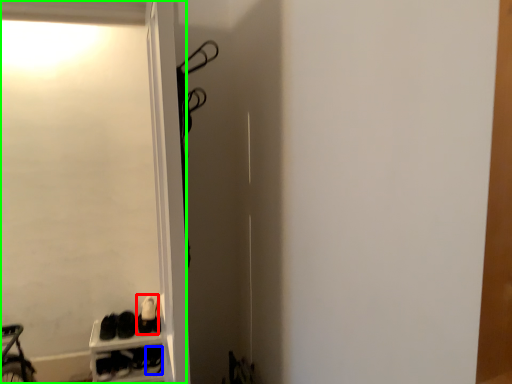
Question: Which is farther away from footwear (highlighted by a red box)? shoe (highlighted by a blue box) or screen door (highlighted by a green box)?

Choices:
 (A) shoe
 (B) screen door

Answer: (B)